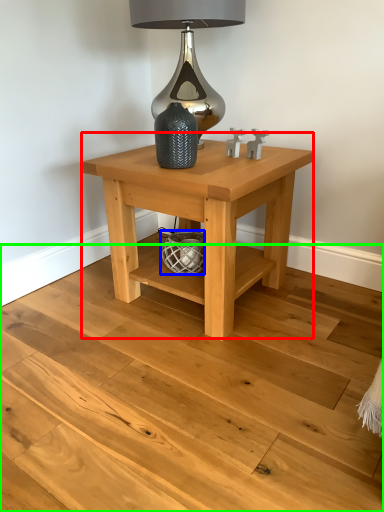
Question: Considering the real-world distances, which object is farthest from table (highlighted by a red box)? basket (highlighted by a blue box) or stair (highlighted by a green box)?

Choices:
 (A) basket
 (B) stair

Answer: (B)